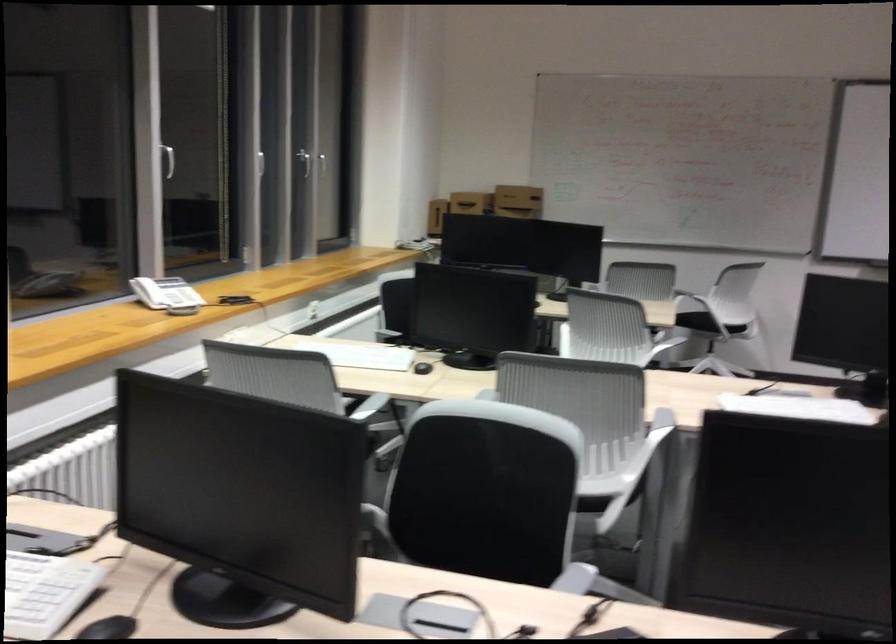
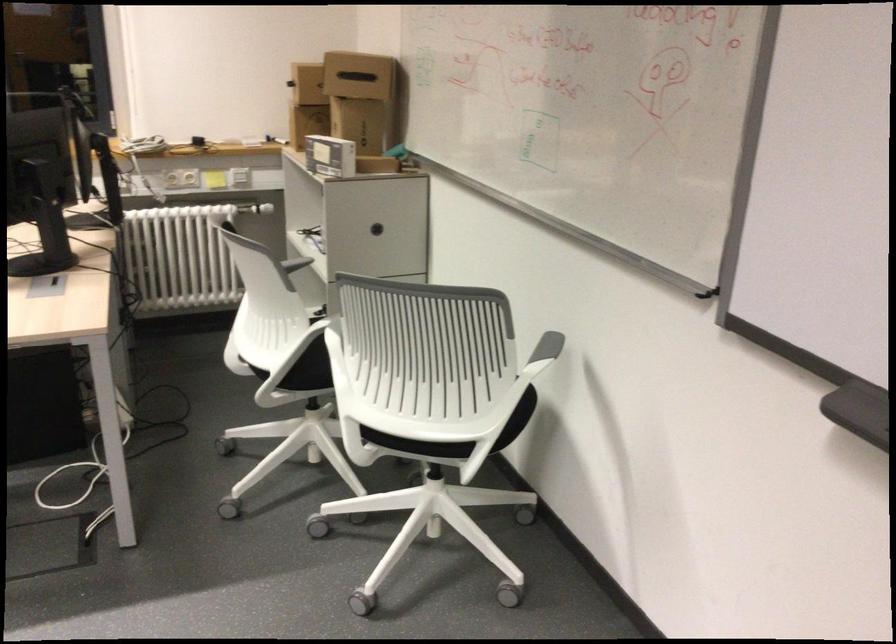
In the second image, find the point that corresponds to pixel 685 316 in the first image.

(307, 375)